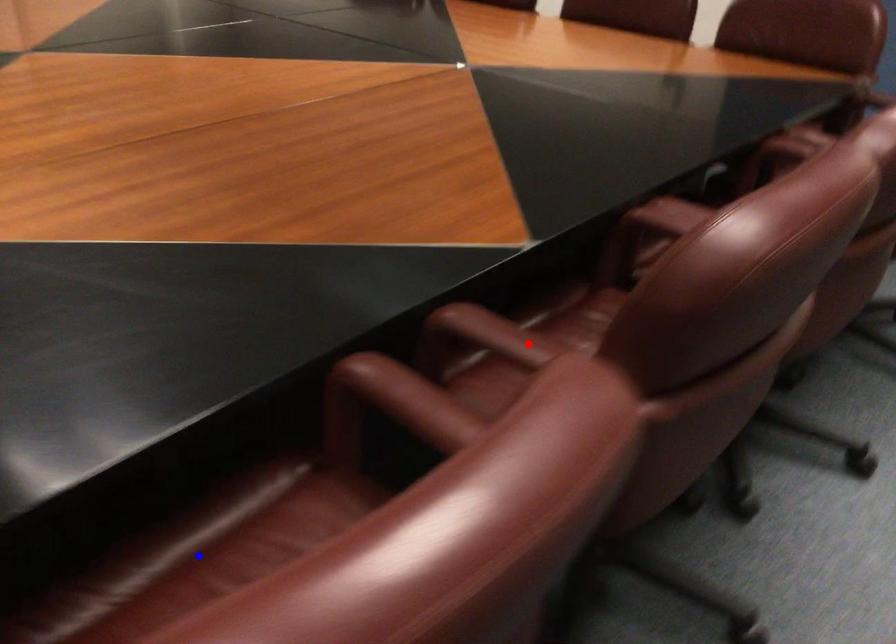
Question: In the image, two points are highlighted. Which point is nearer to the camera? Reply with the corresponding letter.

Choices:
 (A) blue point
 (B) red point

Answer: (A)